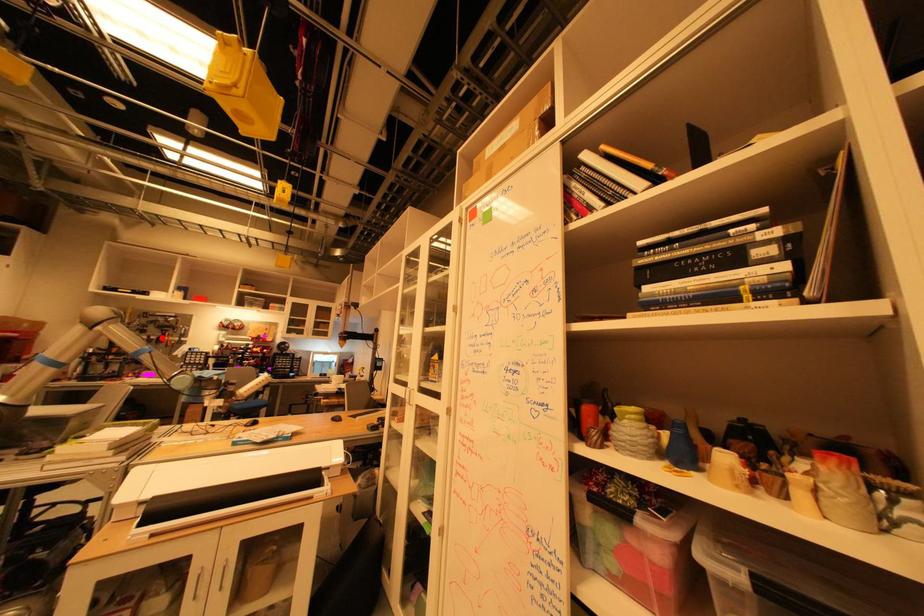
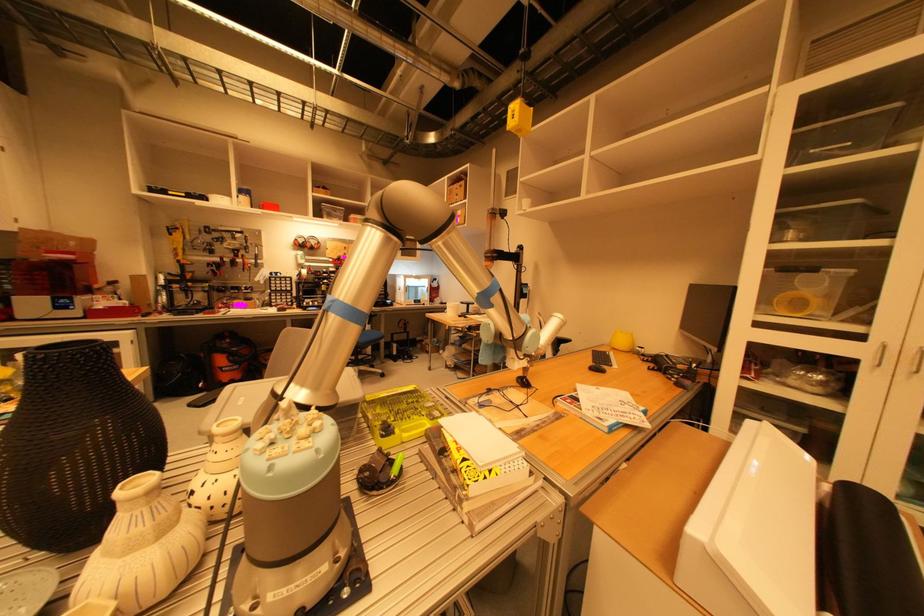
Question: I am providing you with two images of the same scene from different viewpoints. A red point is marked on the first image. Can you still see the location of the red point in image 2?

Choices:
 (A) Yes
 (B) No

Answer: (A)